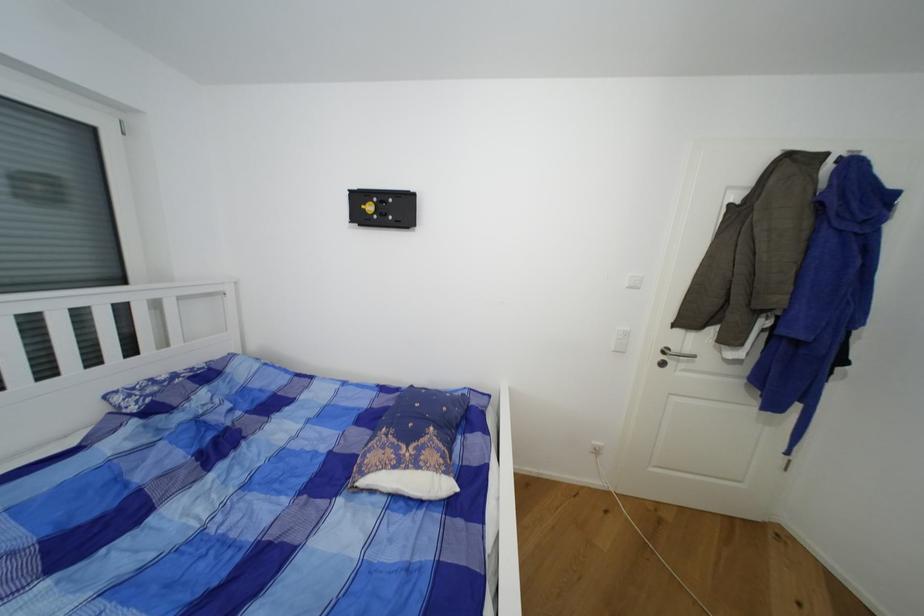
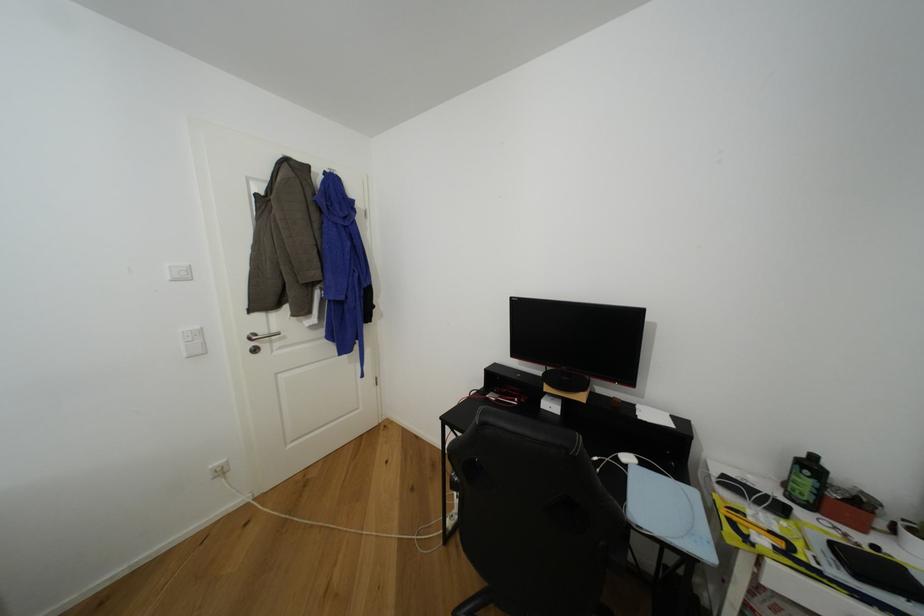
Locate, in the second image, the point that corresponds to (x=681, y=351) in the first image.

(268, 334)